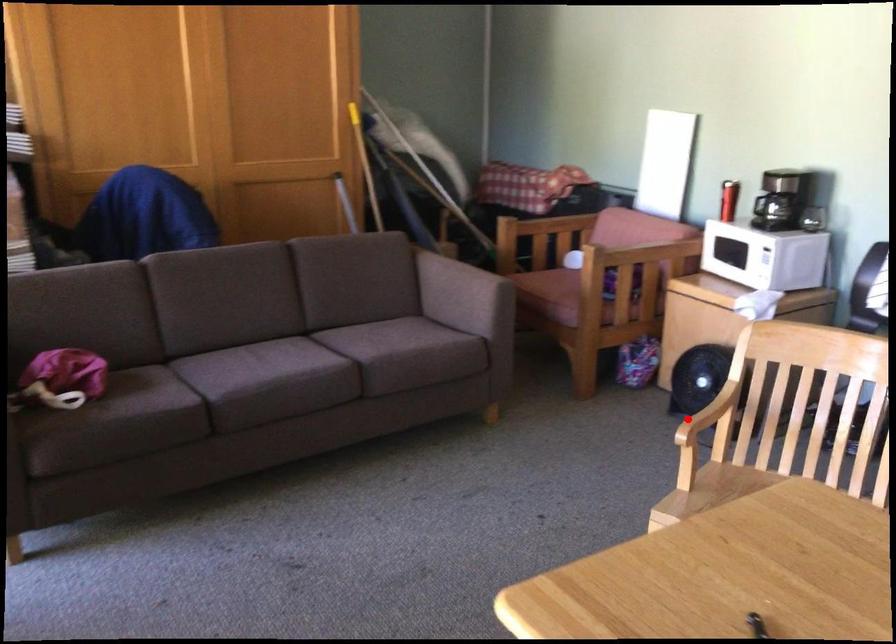
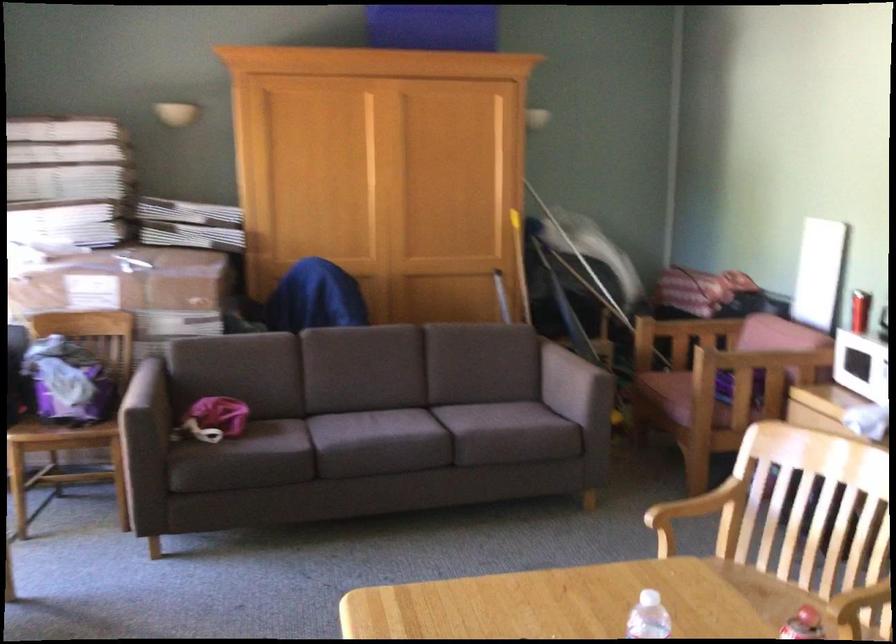
In the second image, find the point that corresponds to the highlighted location in the first image.

(694, 512)